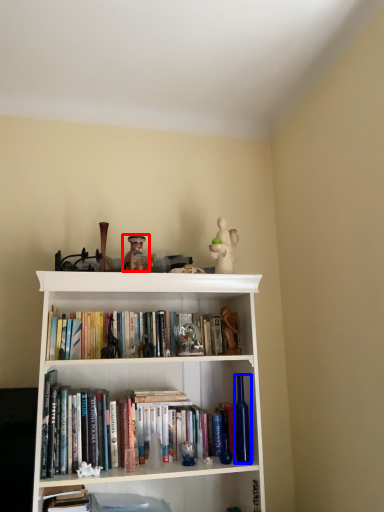
Question: Which of the following is the farthest to the observer, toy (highlighted by a red box) or bottle (highlighted by a blue box)?

Choices:
 (A) toy
 (B) bottle

Answer: (A)